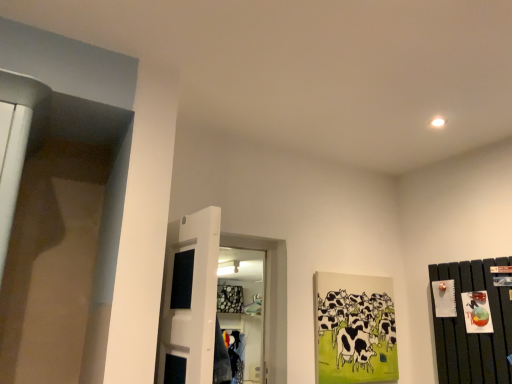
Question: Does black and white painted cows at center right touch dark wood dresser at right?

Choices:
 (A) no
 (B) yes

Answer: (A)

Question: Is black and white painted cows at center right to the left of dark wood dresser at right from the viewer's perspective?

Choices:
 (A) no
 (B) yes

Answer: (B)

Question: From a real-world perspective, does black and white painted cows at center right sit lower than dark wood dresser at right?

Choices:
 (A) no
 (B) yes

Answer: (B)

Question: From the image's perspective, is black and white painted cows at center right below dark wood dresser at right?

Choices:
 (A) yes
 (B) no

Answer: (A)

Question: Can you confirm if black and white painted cows at center right is shorter than dark wood dresser at right?

Choices:
 (A) yes
 (B) no

Answer: (A)

Question: Considering the relative sizes of black and white painted cows at center right and dark wood dresser at right in the image provided, is black and white painted cows at center right smaller than dark wood dresser at right?

Choices:
 (A) no
 (B) yes

Answer: (B)

Question: Are dark wood dresser at right and white glossy door at center located far from each other?

Choices:
 (A) no
 (B) yes

Answer: (B)

Question: Can you confirm if dark wood dresser at right is positioned to the right of white glossy door at center?

Choices:
 (A) no
 (B) yes

Answer: (B)

Question: Is dark wood dresser at right smaller than white glossy door at center?

Choices:
 (A) yes
 (B) no

Answer: (A)

Question: From the image's perspective, would you say dark wood dresser at right is shown under white glossy door at center?

Choices:
 (A) yes
 (B) no

Answer: (A)

Question: Does dark wood dresser at right have a lesser width compared to white glossy door at center?

Choices:
 (A) yes
 (B) no

Answer: (A)

Question: Can you confirm if dark wood dresser at right is wider than white glossy door at center?

Choices:
 (A) yes
 (B) no

Answer: (B)

Question: Can dark wood dresser at right be found inside white glossy door at center?

Choices:
 (A) yes
 (B) no

Answer: (B)